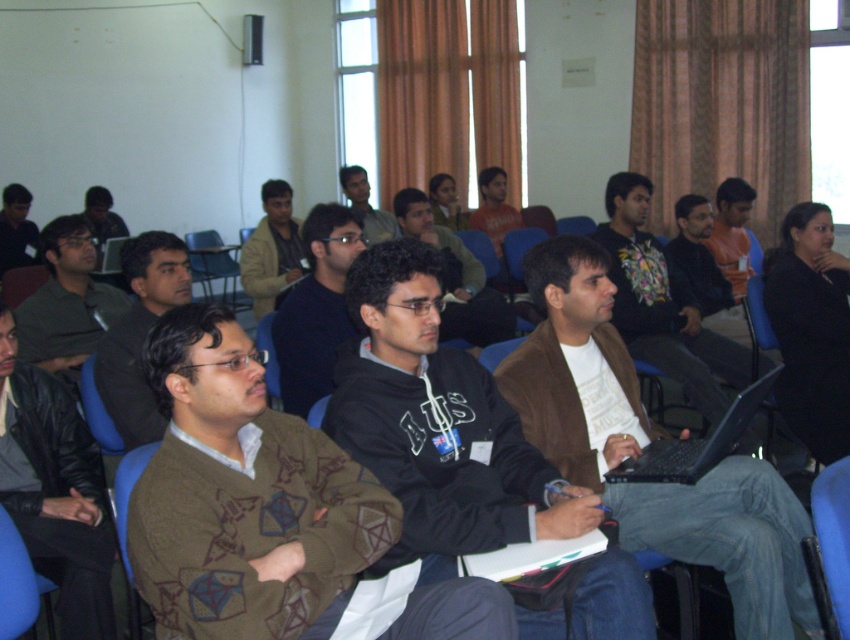
Between point (690, 388) and point (32, 225), which one is positioned in front?

Point (690, 388) is more forward.

Describe the element at coordinates (663, 305) in the screenshot. The height and width of the screenshot is (640, 850). I see `white cotton shirt at center` at that location.

Where is `white cotton shirt at center`? white cotton shirt at center is located at coordinates (663, 305).

Can you confirm if brown suede jacket at center is bigger than matte black jacket at left?

Yes.

Between point (650, 540) and point (20, 262), which one is positioned behind?

The point (20, 262) is more distant.

Identify the location of brown suede jacket at center. (644, 448).

Looking at this image, does dark gray hoodie at center lie behind matte black laptop at upper left?

No, it is in front of matte black laptop at upper left.

Who is positioned more to the right, dark gray hoodie at center or matte black laptop at upper left?

dark gray hoodie at center

Is point (480, 296) closer to viewer compared to point (94, 189)?

Yes, it is.

Where is `dark gray hoodie at center`? The width and height of the screenshot is (850, 640). dark gray hoodie at center is located at coordinates (456, 276).